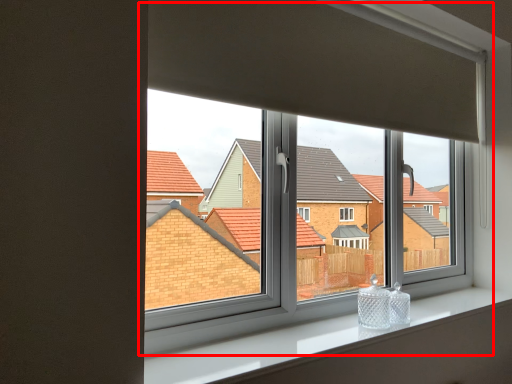
Question: In this image, where is window (annotated by the red box) located relative to window sill?

Choices:
 (A) left
 (B) right

Answer: (A)